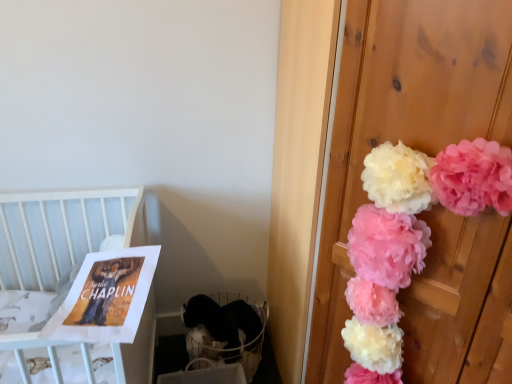
Question: Does white wood crib at upper left have a greater height compared to white fabric baby carriage at lower left?

Choices:
 (A) yes
 (B) no

Answer: (A)

Question: From the image's perspective, is white wood crib at upper left on top of white fabric baby carriage at lower left?

Choices:
 (A) no
 (B) yes

Answer: (B)

Question: Can you confirm if white wood crib at upper left is positioned to the left of white fabric baby carriage at lower left?

Choices:
 (A) no
 (B) yes

Answer: (B)

Question: Is white wood crib at upper left far from white fabric baby carriage at lower left?

Choices:
 (A) yes
 (B) no

Answer: (B)

Question: Does white wood crib at upper left have a smaller size compared to white fabric baby carriage at lower left?

Choices:
 (A) yes
 (B) no

Answer: (B)

Question: In terms of size, does white fabric baby carriage at lower left appear bigger or smaller than pink fluffy pom-poms at right?

Choices:
 (A) big
 (B) small

Answer: (B)

Question: Which is correct: white fabric baby carriage at lower left is inside pink fluffy pom-poms at right, or outside of it?

Choices:
 (A) inside
 (B) outside

Answer: (B)

Question: From the image's perspective, is white fabric baby carriage at lower left positioned above or below pink fluffy pom-poms at right?

Choices:
 (A) below
 (B) above

Answer: (A)

Question: Visually, is white fabric baby carriage at lower left positioned to the left or to the right of pink fluffy pom-poms at right?

Choices:
 (A) right
 (B) left

Answer: (B)

Question: From a real-world perspective, is white fabric baby carriage at lower left positioned above or below matte paper poster at left?

Choices:
 (A) above
 (B) below

Answer: (B)

Question: Considering the positions of white fabric baby carriage at lower left and matte paper poster at left in the image, is white fabric baby carriage at lower left wider or thinner than matte paper poster at left?

Choices:
 (A) thin
 (B) wide

Answer: (A)

Question: Would you say white fabric baby carriage at lower left is inside or outside matte paper poster at left?

Choices:
 (A) outside
 (B) inside

Answer: (A)

Question: From their relative heights in the image, would you say white fabric baby carriage at lower left is taller or shorter than matte paper poster at left?

Choices:
 (A) tall
 (B) short

Answer: (A)

Question: From the image's perspective, is white wood crib at upper left located above or below pink fluffy pom-poms at right?

Choices:
 (A) below
 (B) above

Answer: (A)

Question: Considering the positions of white wood crib at upper left and pink fluffy pom-poms at right in the image, is white wood crib at upper left wider or thinner than pink fluffy pom-poms at right?

Choices:
 (A) wide
 (B) thin

Answer: (A)